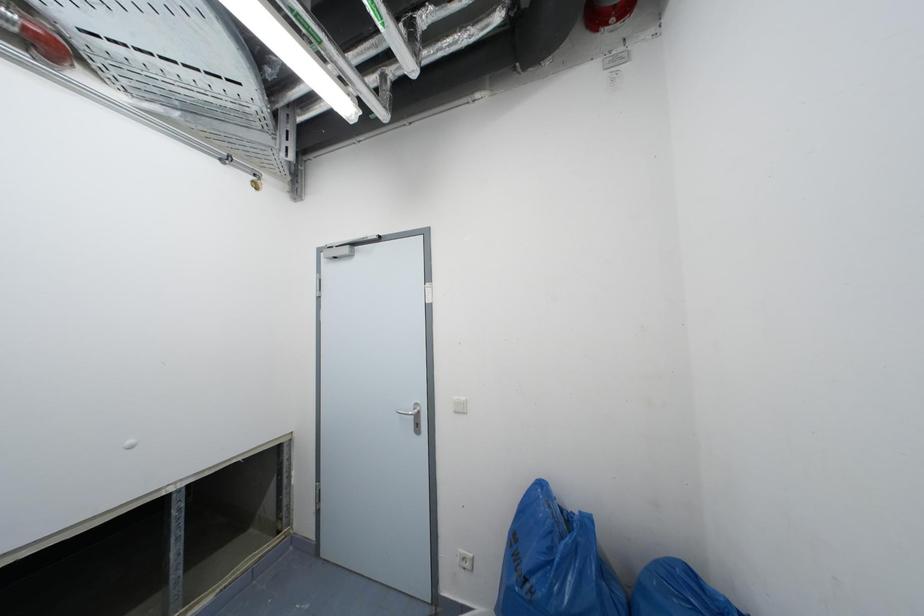
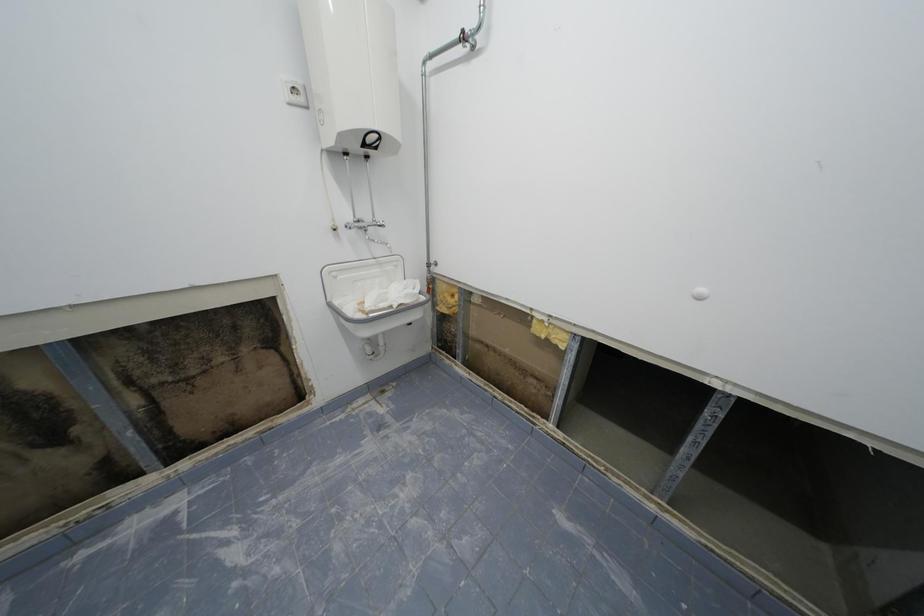
The first image is from the beginning of the video and the second image is from the end. How did the camera likely rotate when shooting the video?

The camera rotated toward left-down.